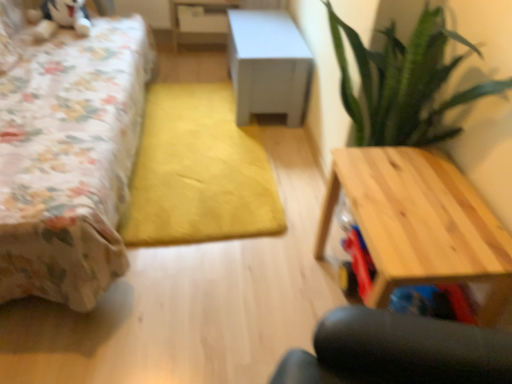
This screenshot has height=384, width=512. In order to click on blank space above light wood table at right, marked as the first table in a front-to-back arrangement (from a real-world perspective) in this screenshot , I will do `click(429, 211)`.